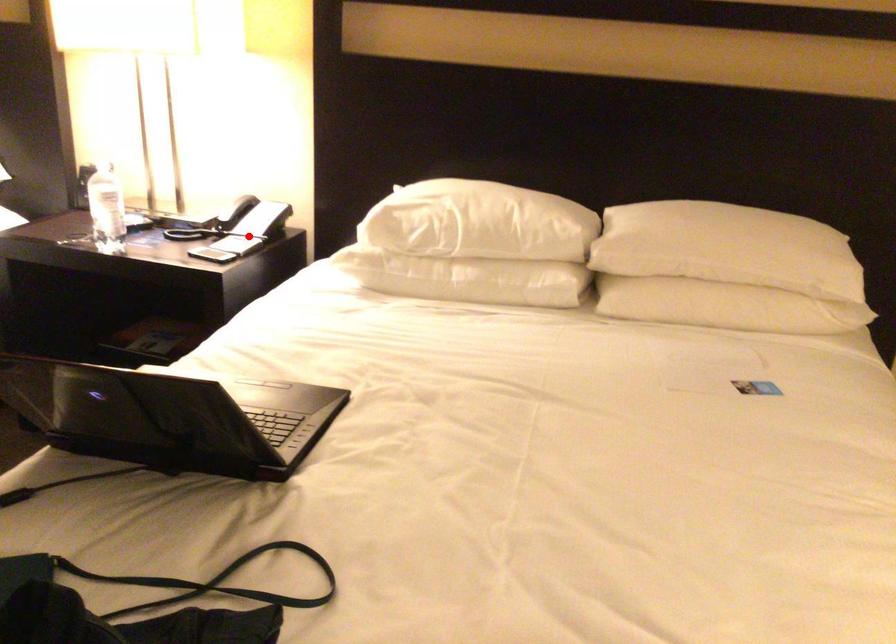
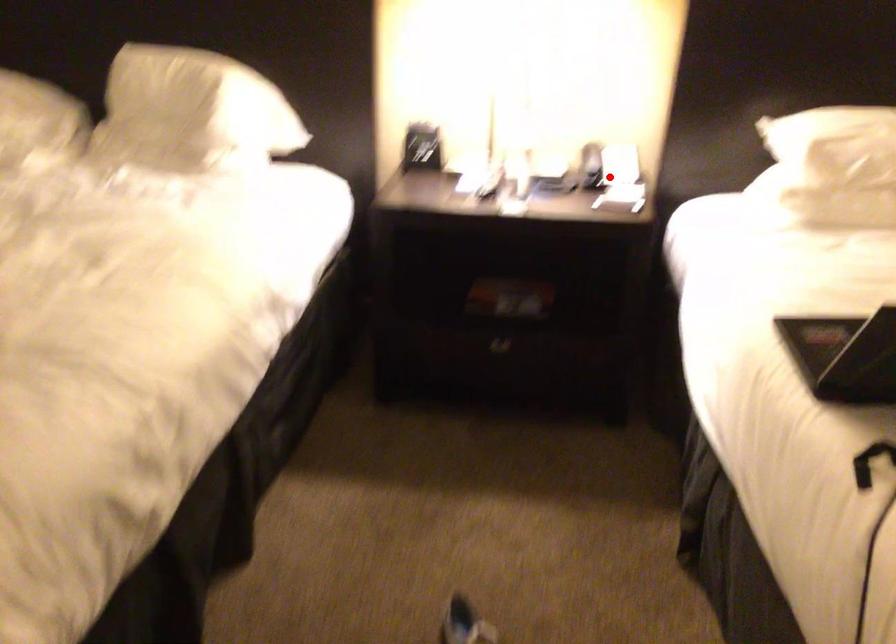
I am providing you with two images of the same scene from different viewpoints. A red point is marked on the first image and another point is marked on the second image. Are the points marked in image1 and image2 representing the same 3D position?

Yes